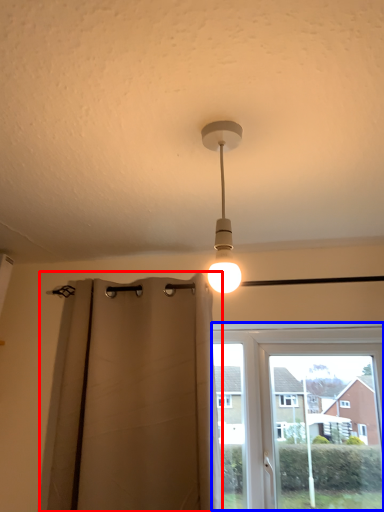
Question: Among these objects, which one is nearest to the camera, curtain (highlighted by a red box) or window (highlighted by a blue box)?

Choices:
 (A) curtain
 (B) window

Answer: (A)